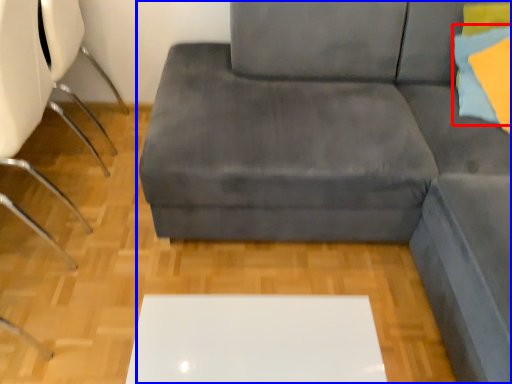
Question: Which of the following is the closest to the observer, pillow (highlighted by a red box) or studio couch (highlighted by a blue box)?

Choices:
 (A) pillow
 (B) studio couch

Answer: (A)